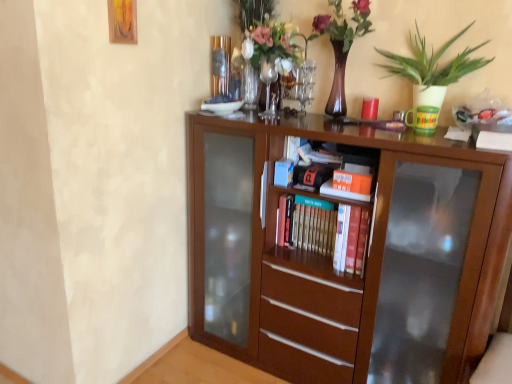
Question: From a real-world perspective, is matte brown vase with flowers at upper center below orange matte book at center, placed as the first book when sorted from front to back?

Choices:
 (A) no
 (B) yes

Answer: (A)

Question: Is matte brown vase with flowers at upper center at the right side of orange matte book at center, which ranks as the 1th book in top-to-bottom order?

Choices:
 (A) yes
 (B) no

Answer: (B)

Question: Is matte brown vase with flowers at upper center closer to the viewer compared to orange matte book at center, placed as the first book when sorted from front to back?

Choices:
 (A) yes
 (B) no

Answer: (A)

Question: From the image's perspective, is matte brown vase with flowers at upper center over orange matte book at center, placed as the first book when sorted from front to back?

Choices:
 (A) no
 (B) yes

Answer: (B)

Question: Is matte brown vase with flowers at upper center further to camera compared to orange matte book at center, which is the second book from bottom to top?

Choices:
 (A) yes
 (B) no

Answer: (B)

Question: Looking at their shapes, would you say wooden picture frame at upper left is wider or thinner than brown wooden bookcase at center?

Choices:
 (A) wide
 (B) thin

Answer: (B)

Question: Is wooden picture frame at upper left spatially inside brown wooden bookcase at center, or outside of it?

Choices:
 (A) inside
 (B) outside

Answer: (B)

Question: From the image's perspective, is wooden picture frame at upper left located above or below brown wooden bookcase at center?

Choices:
 (A) below
 (B) above

Answer: (B)

Question: From a real-world perspective, is wooden picture frame at upper left positioned above or below brown wooden bookcase at center?

Choices:
 (A) above
 (B) below

Answer: (A)

Question: In terms of width, does brown wooden bookcase at center look wider or thinner when compared to matte brown vase with flowers at upper center?

Choices:
 (A) thin
 (B) wide

Answer: (B)

Question: Considering the positions of point (206, 160) and point (336, 62), is point (206, 160) closer or farther from the camera than point (336, 62)?

Choices:
 (A) farther
 (B) closer

Answer: (A)

Question: Considering the positions of brown wooden bookcase at center and matte brown vase with flowers at upper center in the image, is brown wooden bookcase at center bigger or smaller than matte brown vase with flowers at upper center?

Choices:
 (A) small
 (B) big

Answer: (B)

Question: From a real-world perspective, is brown wooden bookcase at center above or below matte brown vase with flowers at upper center?

Choices:
 (A) below
 (B) above

Answer: (A)

Question: Is matte brown vase with flowers at upper center bigger or smaller than hardcover books at center, placed as the first book when sorted from back to front?

Choices:
 (A) small
 (B) big

Answer: (B)

Question: Is matte brown vase with flowers at upper center in front of or behind hardcover books at center, which is the second book in top-to-bottom order, in the image?

Choices:
 (A) front
 (B) behind

Answer: (A)